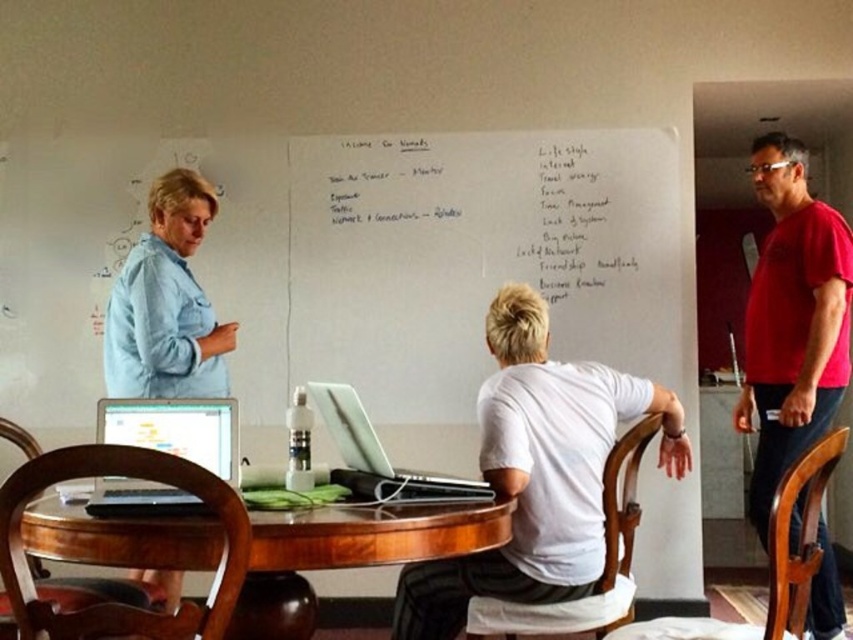
From the picture: Between white matte shirt at center and silver metallic laptop at center, which one appears on the left side from the viewer's perspective?

From the viewer's perspective, silver metallic laptop at center appears more on the left side.

Is point (437, 630) behind point (418, 472)?

No, (437, 630) is closer to viewer.

Locate an element on the screen. white matte shirt at center is located at coordinates (538, 472).

Locate an element on the screen. This screenshot has width=853, height=640. white matte shirt at center is located at coordinates (538, 472).

Locate an element on the screen. This screenshot has width=853, height=640. mahogany wood table at center is located at coordinates (372, 536).

Is point (401, 529) positioned behind point (426, 160)?

That is False.

Locate an element on the screen. The image size is (853, 640). mahogany wood table at center is located at coordinates (372, 536).

Is point (548, 170) behind point (138, 413)?

That is True.

Does white handwritten notes at center have a larger size compared to matte black laptop at lower left?

Actually, white handwritten notes at center might be smaller than matte black laptop at lower left.

Does point (625, 182) come in front of point (230, 461)?

No.

Where is `white handwritten notes at center`? Image resolution: width=853 pixels, height=640 pixels. white handwritten notes at center is located at coordinates (573, 221).